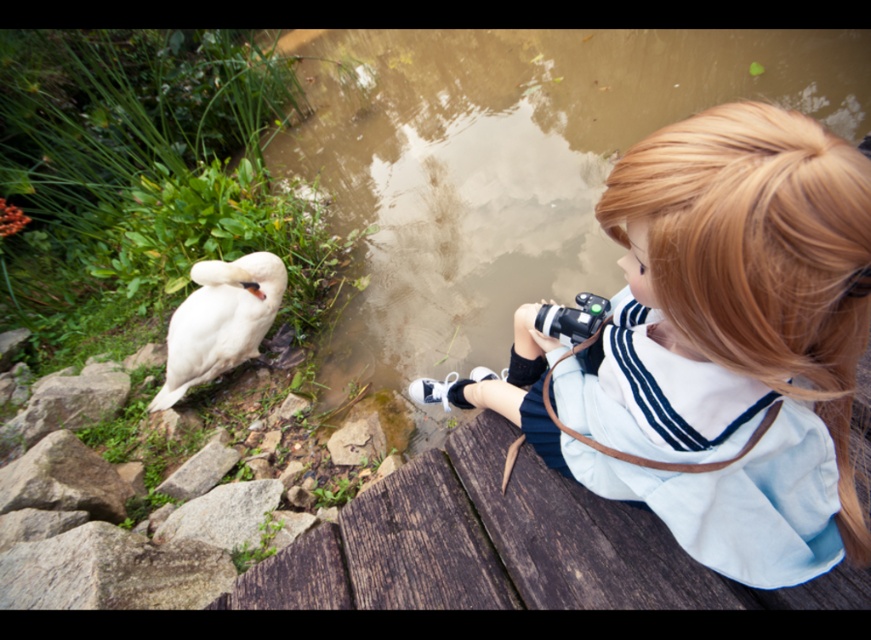
You are a photographer trying to capture a closeup shot of the white matte swan at left using the black rubber camera at center. Considering the camera has a minimum focusing distance of 2 meters, will you be able to take the photo without moving the camera?

The distance between the white matte swan at left and the black rubber camera at center is 2.32 meters, which is beyond the camera minimum focusing distance of 2 meters. Therefore, you can take the closeup shot without moving the camera since the swan is within the camera focusing range.